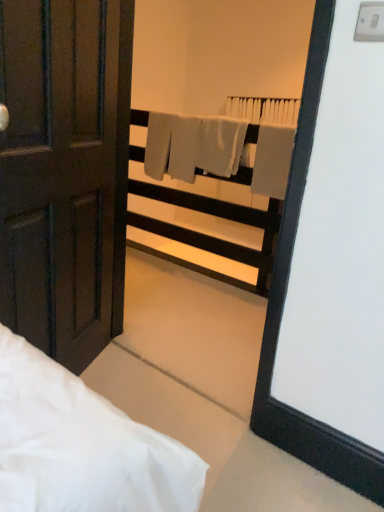
At what (x,y) coordinates should I click in order to perform the action: click on free region under gray matte towel at center (from a real-world perspective). Please return your answer as a coordinate pair (x, y). The image size is (384, 512). Looking at the image, I should click on (247, 291).